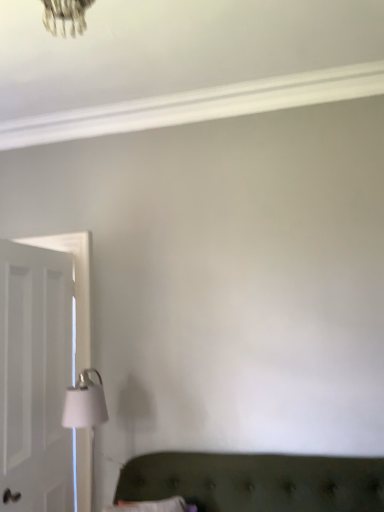
Question: Is white wooden door at left at the left side of white matte table lamp at lower left?

Choices:
 (A) no
 (B) yes

Answer: (B)

Question: Can you confirm if white wooden door at left is bigger than white matte table lamp at lower left?

Choices:
 (A) no
 (B) yes

Answer: (B)

Question: Could you tell me if white wooden door at left is turned towards white matte table lamp at lower left?

Choices:
 (A) no
 (B) yes

Answer: (B)

Question: Does white wooden door at left have a smaller size compared to white matte table lamp at lower left?

Choices:
 (A) yes
 (B) no

Answer: (B)

Question: Is white wooden door at left facing away from white matte table lamp at lower left?

Choices:
 (A) yes
 (B) no

Answer: (A)

Question: Considering the relative sizes of white wooden door at left and white matte table lamp at lower left in the image provided, is white wooden door at left taller than white matte table lamp at lower left?

Choices:
 (A) no
 (B) yes

Answer: (B)

Question: Considering the relative sizes of white matte table lamp at lower left and white wooden door at left in the image provided, is white matte table lamp at lower left wider than white wooden door at left?

Choices:
 (A) yes
 (B) no

Answer: (A)

Question: Considering the relative positions of white matte table lamp at lower left and white wooden door at left in the image provided, is white matte table lamp at lower left behind white wooden door at left?

Choices:
 (A) yes
 (B) no

Answer: (A)

Question: From the image's perspective, is white matte table lamp at lower left under white wooden door at left?

Choices:
 (A) yes
 (B) no

Answer: (A)

Question: Considering the relative sizes of white matte table lamp at lower left and white wooden door at left in the image provided, is white matte table lamp at lower left taller than white wooden door at left?

Choices:
 (A) yes
 (B) no

Answer: (B)

Question: Is white matte table lamp at lower left to the left of white wooden door at left from the viewer's perspective?

Choices:
 (A) no
 (B) yes

Answer: (A)

Question: Is white matte table lamp at lower left at the right side of white wooden door at left?

Choices:
 (A) yes
 (B) no

Answer: (A)

Question: Does point (81, 376) appear closer or farther from the camera than point (0, 329)?

Choices:
 (A) farther
 (B) closer

Answer: (A)